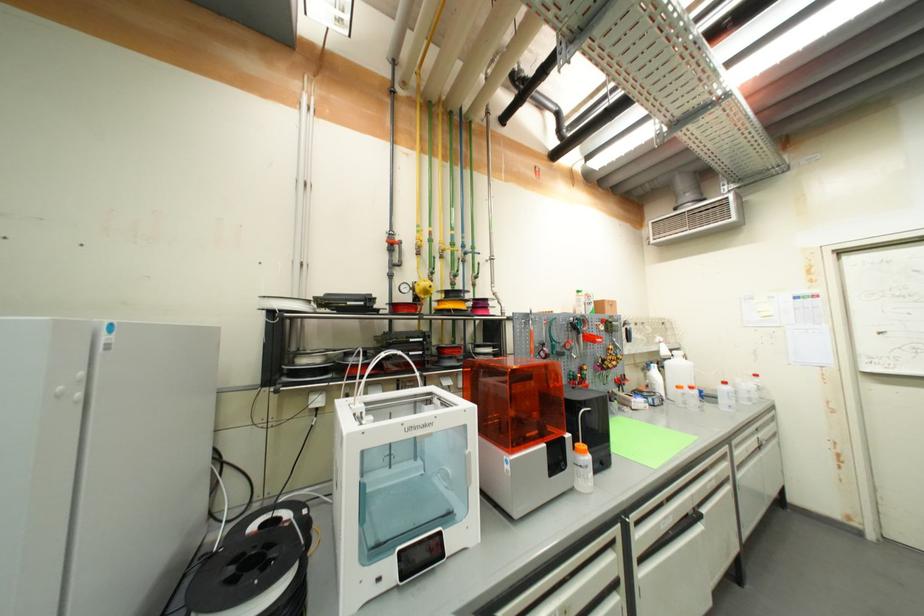
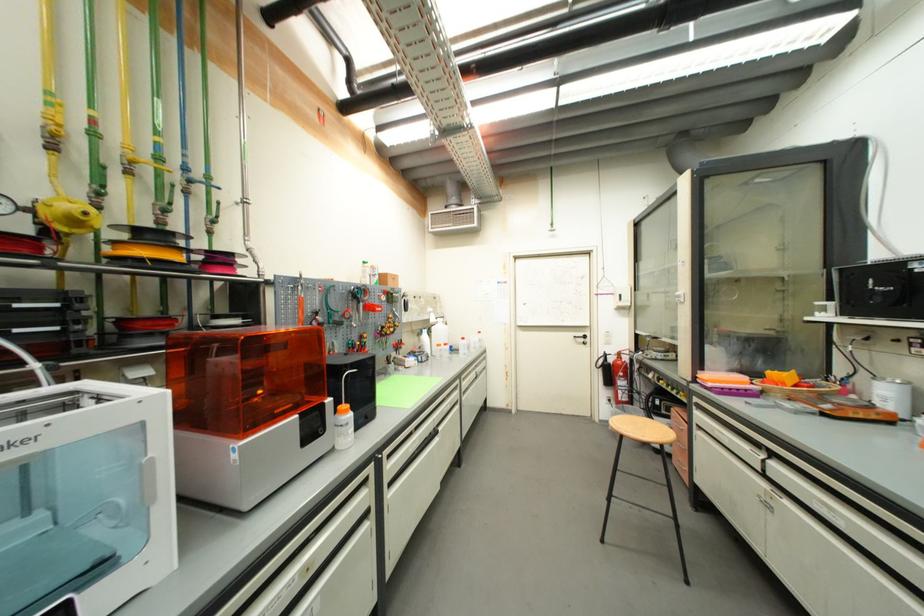
Locate, in the second image, the point that corresponds to (555,322) in the first image.

(334, 289)